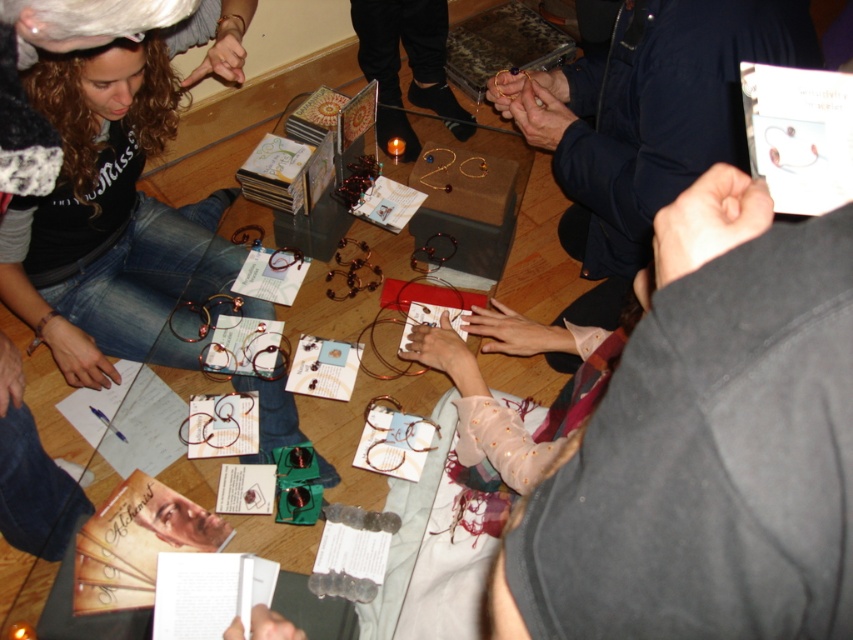
Question: Which point is farther from the camera taking this photo?

Choices:
 (A) (189, 152)
 (B) (387, 26)
 (C) (79, 228)

Answer: (A)

Question: From the image, what is the correct spatial relationship of matte black hairband at lower left in relation to transparent glass table at center?

Choices:
 (A) above
 (B) below

Answer: (A)

Question: Estimate the real-world distances between objects in this image. Which object is farther from the matte black jacket at upper right?

Choices:
 (A) matte black bracelet at center
 (B) transparent glass table at center
 (C) matte black hairband at lower left

Answer: (A)

Question: Is matte black jacket at upper right below matte black bracelet at center?

Choices:
 (A) no
 (B) yes

Answer: (B)

Question: Can you confirm if matte black jacket at upper right is positioned to the left of transparent glass table at center?

Choices:
 (A) yes
 (B) no

Answer: (B)

Question: Among these objects, which one is nearest to the camera?

Choices:
 (A) matte black bracelet at center
 (B) matte black jacket at upper right
 (C) transparent glass table at center

Answer: (B)